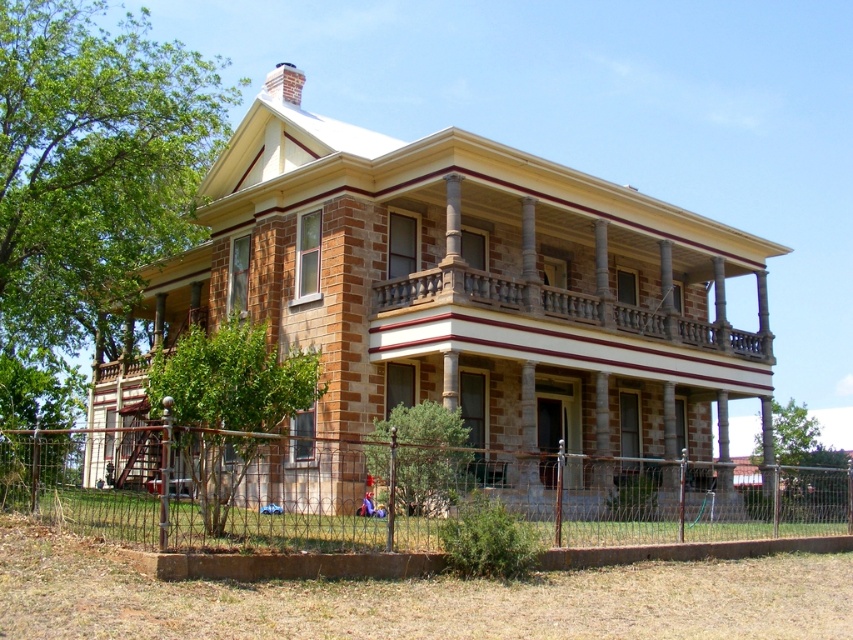
Question: Is rusty metal fence at lower center above brown stone balcony at upper center?

Choices:
 (A) no
 (B) yes

Answer: (A)

Question: Is rusty metal fence at lower center below brown stone balcony at upper center?

Choices:
 (A) no
 (B) yes

Answer: (B)

Question: Can you confirm if rusty metal fence at lower center is bigger than brown stone balcony at upper center?

Choices:
 (A) no
 (B) yes

Answer: (B)

Question: Among these objects, which one is farthest from the camera?

Choices:
 (A) brown stone balcony at upper center
 (B) rusty metal fence at lower center

Answer: (A)